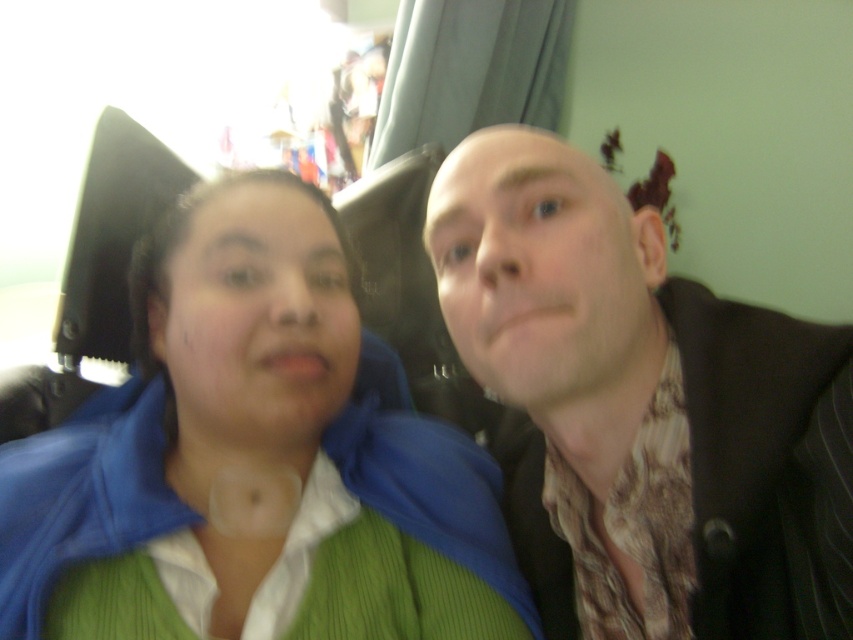
You are standing in the room and want to determine which of the two points, point (184, 417) or point (814, 456), is closer to you. Based on the scene description, which point is nearer?

Point (184, 417) is closer to the viewer than point (814, 456) because the Objects Description states that point (184, 417) is further to the viewer than point (814, 456).

You are a photographer trying to capture a closeup of both the green knitted sweater at center and the brown textured scarf at center. Since you can only focus on one item at a time, which one should you focus on first if you want to ensure the other is in the background?

The green knitted sweater at center is positioned on the left side of brown textured scarf at center. Since the photographer can only focus on one item at a time, focusing on the green knitted sweater at center first would place the brown textured scarf at center in the background. Alternatively, focusing on the brown textured scarf at center would put the green knitted sweater at center in the background. Either choice works depending on desired emphasis.